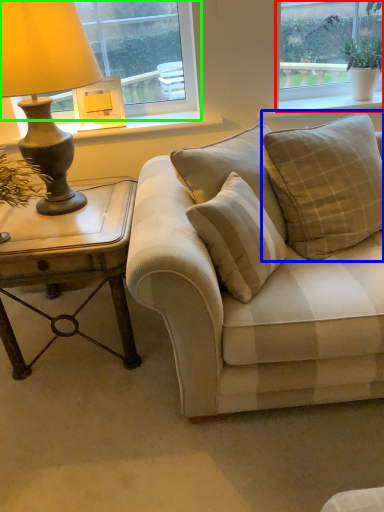
Question: Which object is positioned farthest from window (highlighted by a red box)? Select from pillow (highlighted by a blue box) and window (highlighted by a green box).

Choices:
 (A) pillow
 (B) window

Answer: (A)